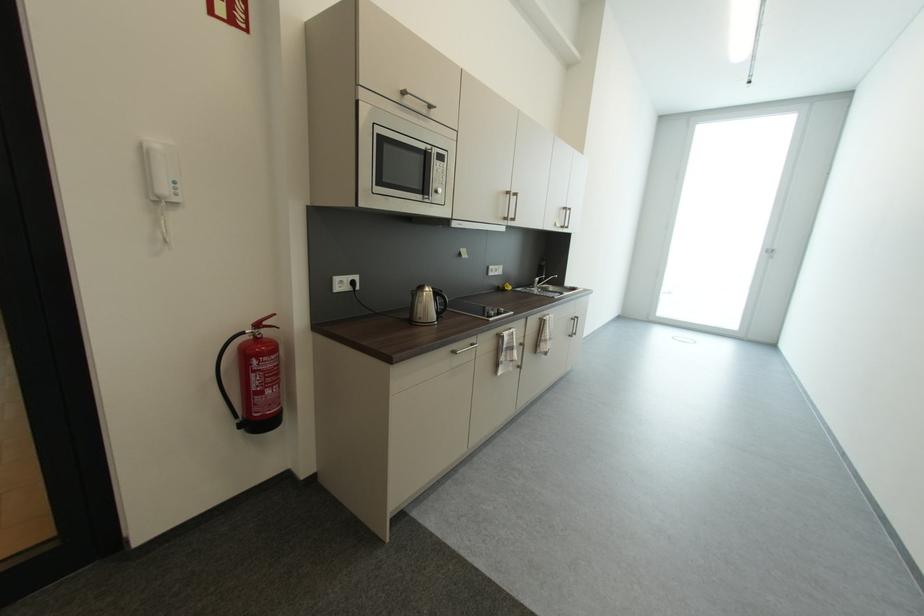
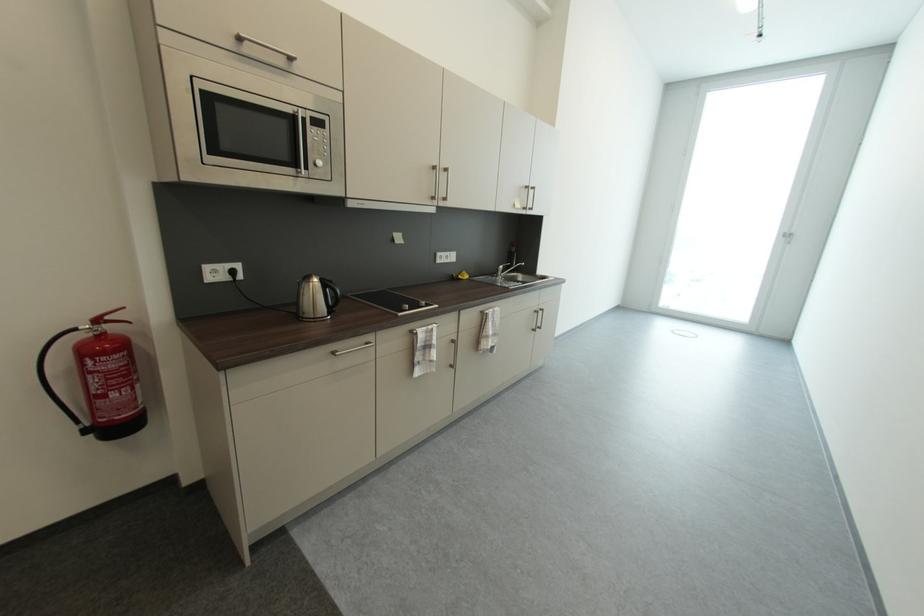
In the second image, find the point that corresponds to (513,290) in the first image.

(467, 278)